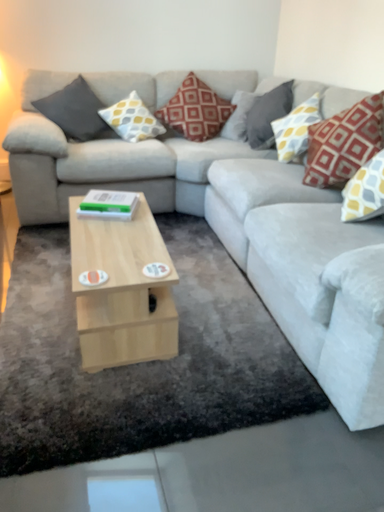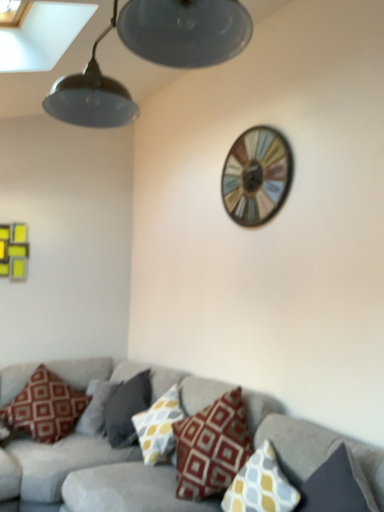
Question: How did the camera likely rotate when shooting the video?

Choices:
 (A) rotated downward
 (B) rotated upward

Answer: (B)